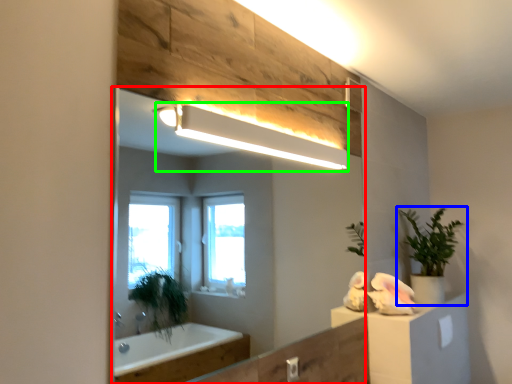
Question: Considering the real-world distances, which object is farthest from mirror (highlighted by a red box)? houseplant (highlighted by a blue box) or light fixture (highlighted by a green box)?

Choices:
 (A) houseplant
 (B) light fixture

Answer: (B)